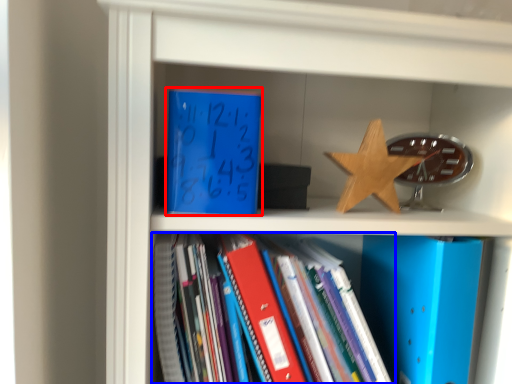
Question: Which point is further to the camera, paperback book (highlighted by a red box) or book (highlighted by a blue box)?

Choices:
 (A) paperback book
 (B) book

Answer: (A)